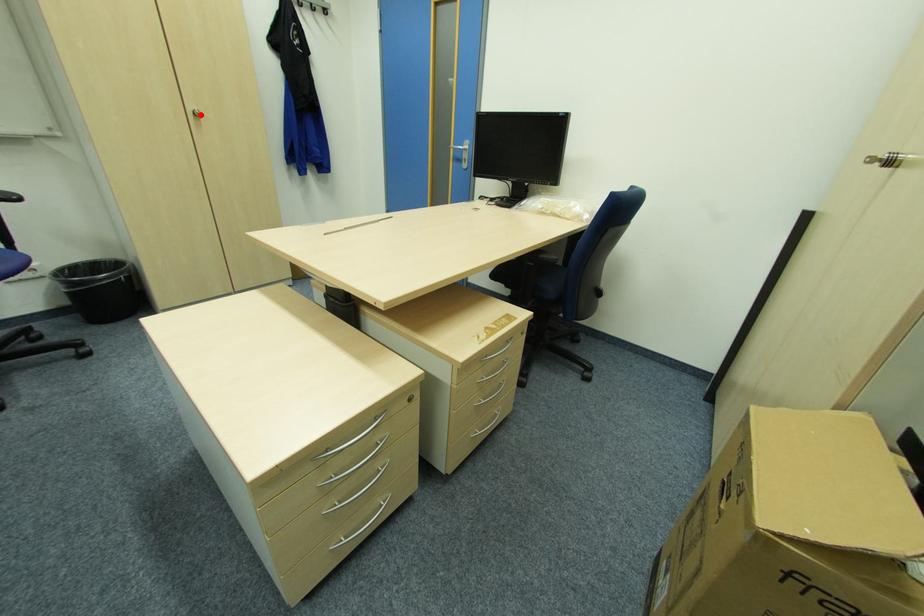
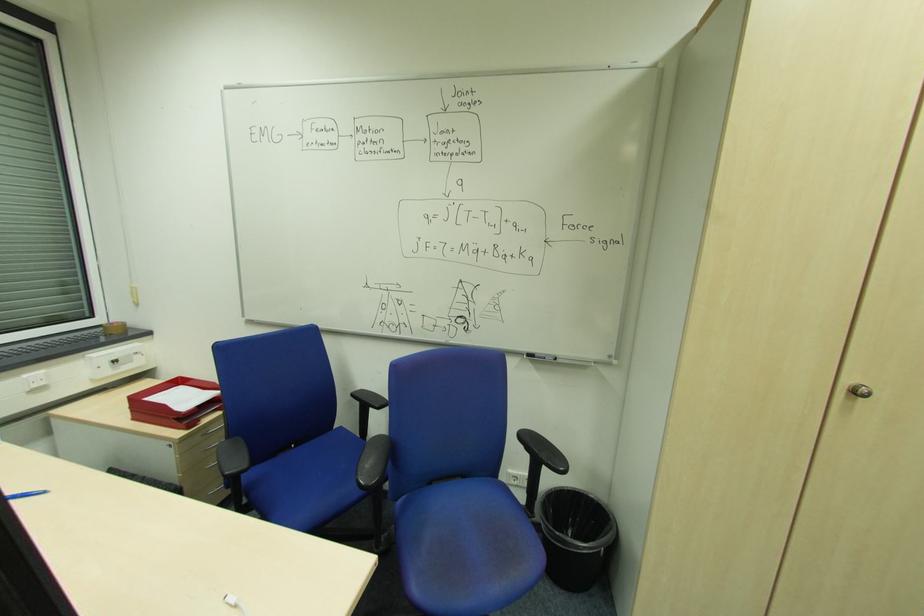
Question: I am providing you with two images of the same scene from different viewpoints. A red point is shown in image1. For the corresponding object point in image2, is it positioned nearer or farther from the camera?

Choices:
 (A) Nearer
 (B) Farther

Answer: (A)